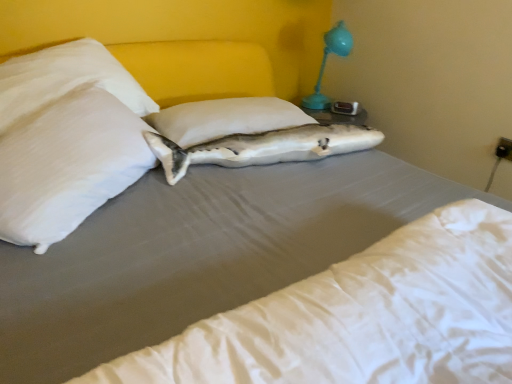
Question: Is white smooth mattress at center facing towards white satin pillow at upper left, arranged as the 2th pillow when viewed from the right?

Choices:
 (A) yes
 (B) no

Answer: (B)

Question: From the image's perspective, is white smooth mattress at center below white satin pillow at upper left, arranged as the 1th pillow when viewed from the left?

Choices:
 (A) yes
 (B) no

Answer: (A)

Question: Is white smooth mattress at center positioned beyond the bounds of white satin pillow at upper left, arranged as the 1th pillow when viewed from the left?

Choices:
 (A) yes
 (B) no

Answer: (A)

Question: Considering the relative sizes of white smooth mattress at center and white satin pillow at upper left, arranged as the 2th pillow when viewed from the right, in the image provided, is white smooth mattress at center wider than white satin pillow at upper left, arranged as the 2th pillow when viewed from the right,?

Choices:
 (A) yes
 (B) no

Answer: (A)

Question: Does white smooth mattress at center have a larger size compared to white satin pillow at upper left, arranged as the 2th pillow when viewed from the right?

Choices:
 (A) no
 (B) yes

Answer: (A)

Question: Is white smooth mattress at center at the left side of white satin pillow at upper left, arranged as the 1th pillow when viewed from the left?

Choices:
 (A) yes
 (B) no

Answer: (B)

Question: From the image's perspective, is white smooth mattress at center over white fabric pillow at center, the 2th pillow from the left?

Choices:
 (A) no
 (B) yes

Answer: (A)

Question: Is the surface of white smooth mattress at center in direct contact with white fabric pillow at center, the 2th pillow from the left?

Choices:
 (A) yes
 (B) no

Answer: (B)

Question: Is white smooth mattress at center smaller than white fabric pillow at center, the first pillow in the right-to-left sequence?

Choices:
 (A) no
 (B) yes

Answer: (A)

Question: Is white smooth mattress at center not within white fabric pillow at center, the 2th pillow from the left?

Choices:
 (A) no
 (B) yes

Answer: (B)

Question: Is white smooth mattress at center at the right side of white fabric pillow at center, the first pillow in the right-to-left sequence?

Choices:
 (A) yes
 (B) no

Answer: (A)

Question: Considering the relative sizes of white smooth mattress at center and white fabric pillow at center, the 2th pillow from the left, in the image provided, is white smooth mattress at center wider than white fabric pillow at center, the 2th pillow from the left,?

Choices:
 (A) yes
 (B) no

Answer: (A)

Question: Can you confirm if white smooth mattress at center is smaller than white matte fish at center?

Choices:
 (A) no
 (B) yes

Answer: (A)